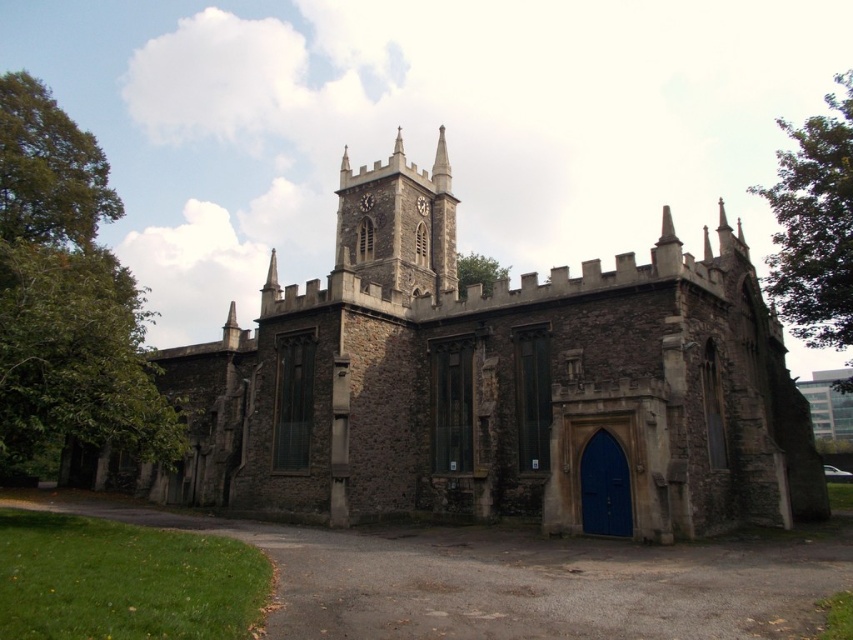
Question: Does dark gray stone clock tower at center come in front of blue matte door at center?

Choices:
 (A) yes
 (B) no

Answer: (B)

Question: Which of the following is the farthest from the observer?

Choices:
 (A) blue matte door at center
 (B) dark gray stone clock tower at center
 (C) stone church at center
 (D) metallic clock at center

Answer: (D)

Question: Which object is positioned closest to the blue matte door at center?

Choices:
 (A) dark gray stone clock tower at center
 (B) stone church at center
 (C) metallic clock at center

Answer: (B)

Question: Can you confirm if stone church at center is thinner than dark gray stone clock tower at center?

Choices:
 (A) no
 (B) yes

Answer: (A)

Question: Which object is farther from the camera taking this photo?

Choices:
 (A) metallic clock at center
 (B) blue matte door at center
 (C) stone church at center

Answer: (A)

Question: Is dark gray stone clock tower at center thinner than blue matte door at center?

Choices:
 (A) no
 (B) yes

Answer: (A)